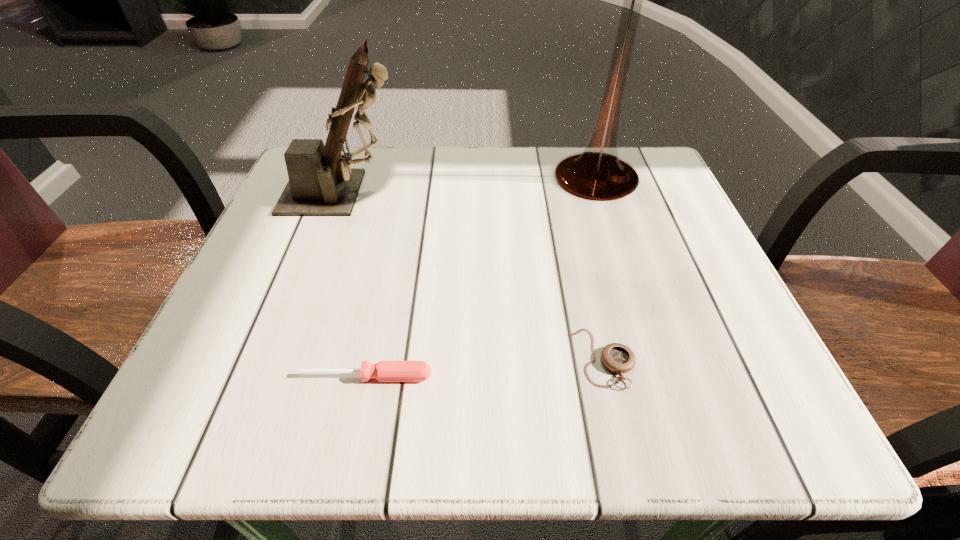
Where is `screwdriver located at the near edge`? The image size is (960, 540). screwdriver located at the near edge is located at coordinates (384, 371).

This screenshot has width=960, height=540. I want to click on pocket watch that is at the near edge, so click(x=618, y=358).

This screenshot has height=540, width=960. What are the coordinates of `figurine located in the left edge section of the desktop` in the screenshot? It's located at (321, 182).

At what (x,y) coordinates should I click in order to perform the action: click on screwdriver at the left edge. Please return your answer as a coordinate pair (x, y). The height and width of the screenshot is (540, 960). Looking at the image, I should click on (384, 371).

Where is `object positioned at the right edge`? object positioned at the right edge is located at coordinates (598, 173).

Locate an element on the screen. object at the far left corner is located at coordinates (321, 182).

Find the location of a particular element. Image resolution: width=960 pixels, height=540 pixels. object positioned at the near left corner is located at coordinates (384, 371).

The height and width of the screenshot is (540, 960). I want to click on object situated at the far right corner, so click(598, 173).

Image resolution: width=960 pixels, height=540 pixels. Identify the location of vacant region at the far edge of the desktop. (452, 146).

At what (x,y) coordinates should I click in order to perform the action: click on vacant space at the near edge of the desktop. Please return your answer as a coordinate pair (x, y). Looking at the image, I should click on (592, 415).